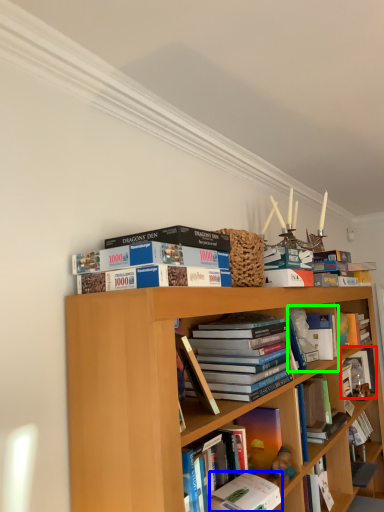
Question: Which object is positioned farthest from book (highlighted by a red box)? Select from book (highlighted by a blue box) and book (highlighted by a green box).

Choices:
 (A) book
 (B) book

Answer: (A)